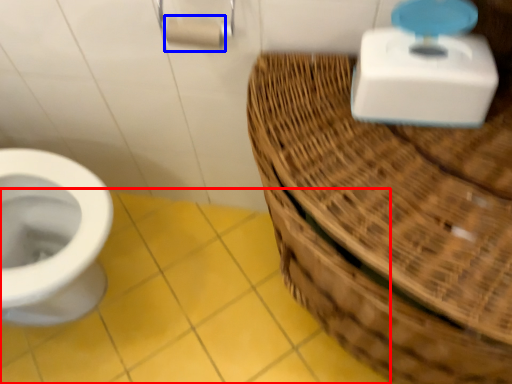
Question: Which point is further to the camera, ceramic tile (highlighted by a red box) or toilet paper (highlighted by a blue box)?

Choices:
 (A) ceramic tile
 (B) toilet paper

Answer: (A)